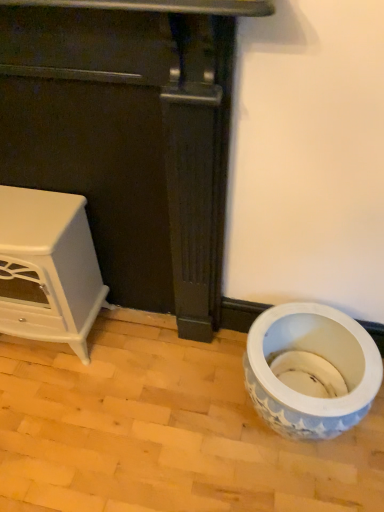
What do you see at coordinates (320, 356) in the screenshot? I see `blue and white ceramic vase at lower right` at bounding box center [320, 356].

Looking at this image, what is the approximate width of white glossy stove at left, which ranks as the 2th furniture in left-to-right order?

It is 7.08 inches.

This screenshot has height=512, width=384. Find the location of `blue and white ceramic vase at lower right`. blue and white ceramic vase at lower right is located at coordinates (320, 356).

Is white glossy stove at left, which ranks as the 2th furniture in left-to-right order, completely or partially outside of blue and white ceramic vase at lower right?

white glossy stove at left, which ranks as the 2th furniture in left-to-right order, is positioned outside blue and white ceramic vase at lower right.

Considering the points (103, 80) and (291, 307), which point is in front, point (103, 80) or point (291, 307)?

Positioned in front is point (103, 80).

Can you confirm if white glossy stove at left, which ranks as the 2th furniture in left-to-right order, is positioned to the right of blue and white ceramic vase at lower right?

No, white glossy stove at left, which ranks as the 2th furniture in left-to-right order, is not to the right of blue and white ceramic vase at lower right.

From the image's perspective, would you say white glossy stove at left, which ranks as the 2th furniture in left-to-right order, is shown under blue and white ceramic vase at lower right?

No, from the image's perspective, white glossy stove at left, which ranks as the 2th furniture in left-to-right order, is not below blue and white ceramic vase at lower right.

From a real-world perspective, which is physically above, blue and white ceramic vase at lower right or white glossy cabinet at left, which is the first furniture in left-to-right order?

white glossy cabinet at left, which is the first furniture in left-to-right order, is physically above.

Considering the sizes of blue and white ceramic vase at lower right and white glossy cabinet at left, which is the first furniture in left-to-right order, in the image, is blue and white ceramic vase at lower right taller or shorter than white glossy cabinet at left, which is the first furniture in left-to-right order,?

Considering their sizes, blue and white ceramic vase at lower right has less height than white glossy cabinet at left, which is the first furniture in left-to-right order.

How many degrees apart are the facing directions of blue and white ceramic vase at lower right and white glossy cabinet at left, the 2th furniture when ordered from right to left?

The angle between the facing direction of blue and white ceramic vase at lower right and the facing direction of white glossy cabinet at left, the 2th furniture when ordered from right to left, is 1.75 degrees.

Does blue and white ceramic vase at lower right have a greater width compared to white glossy cabinet at left, which is the first furniture in left-to-right order?

Correct, the width of blue and white ceramic vase at lower right exceeds that of white glossy cabinet at left, which is the first furniture in left-to-right order.

Considering the sizes of objects blue and white ceramic vase at lower right and white glossy stove at left, the first furniture viewed from the right, in the image provided, who is shorter, blue and white ceramic vase at lower right or white glossy stove at left, the first furniture viewed from the right,?

With less height is blue and white ceramic vase at lower right.

Is point (358, 380) positioned behind point (133, 221)?

No.

From the picture: From a real-world perspective, is blue and white ceramic vase at lower right located beneath white glossy stove at left, the first furniture viewed from the right?

Indeed, from a real-world perspective, blue and white ceramic vase at lower right is positioned beneath white glossy stove at left, the first furniture viewed from the right.

Can you confirm if blue and white ceramic vase at lower right is bigger than white glossy stove at left, which ranks as the 2th furniture in left-to-right order?

No, blue and white ceramic vase at lower right is not bigger than white glossy stove at left, which ranks as the 2th furniture in left-to-right order.

From a real-world perspective, is white glossy cabinet at left, which is the first furniture in left-to-right order, above or below white glossy stove at left, which ranks as the 2th furniture in left-to-right order?

From a real-world perspective, white glossy cabinet at left, which is the first furniture in left-to-right order, is physically below white glossy stove at left, which ranks as the 2th furniture in left-to-right order.

Which object is thinner, white glossy cabinet at left, which is the first furniture in left-to-right order, or white glossy stove at left, the first furniture viewed from the right?

white glossy stove at left, the first furniture viewed from the right.

Is white glossy cabinet at left, which is the first furniture in left-to-right order, in front of white glossy stove at left, the first furniture viewed from the right?

No, white glossy cabinet at left, which is the first furniture in left-to-right order, is behind white glossy stove at left, the first furniture viewed from the right.

In terms of height, does white glossy cabinet at left, which is the first furniture in left-to-right order, look taller or shorter compared to blue and white ceramic vase at lower right?

white glossy cabinet at left, which is the first furniture in left-to-right order, is taller than blue and white ceramic vase at lower right.

Is white glossy cabinet at left, the 2th furniture when ordered from right to left, facing away from blue and white ceramic vase at lower right?

No.

Does white glossy cabinet at left, which is the first furniture in left-to-right order, have a smaller size compared to blue and white ceramic vase at lower right?

No.

Locate an element on the screen. furniture behind the white glossy stove at left, the first furniture viewed from the right is located at coordinates (48, 268).

In the image, is white glossy stove at left, the first furniture viewed from the right, on the left side or the right side of white glossy cabinet at left, which is the first furniture in left-to-right order?

white glossy stove at left, the first furniture viewed from the right, is to the right of white glossy cabinet at left, which is the first furniture in left-to-right order.

In the scene shown: Is white glossy stove at left, which ranks as the 2th furniture in left-to-right order, in front of or behind white glossy cabinet at left, which is the first furniture in left-to-right order, in the image?

white glossy stove at left, which ranks as the 2th furniture in left-to-right order, is in front of white glossy cabinet at left, which is the first furniture in left-to-right order.

How many degrees apart are the facing directions of white glossy stove at left, the first furniture viewed from the right, and white glossy cabinet at left, the 2th furniture when ordered from right to left?

The angular difference between white glossy stove at left, the first furniture viewed from the right, and white glossy cabinet at left, the 2th furniture when ordered from right to left, is 0.402 degrees.

Locate an element on the screen. The height and width of the screenshot is (512, 384). toilet that appears on the right of white glossy stove at left, the first furniture viewed from the right is located at coordinates (320, 356).

This screenshot has height=512, width=384. What are the coordinates of `toilet in front of the white glossy cabinet at left, which is the first furniture in left-to-right order` in the screenshot? It's located at (320, 356).

Estimate the real-world distances between objects in this image. Which object is closer to blue and white ceramic vase at lower right, white glossy cabinet at left, the 2th furniture when ordered from right to left, or white glossy stove at left, the first furniture viewed from the right?

white glossy stove at left, the first furniture viewed from the right.

When comparing their distances from white glossy cabinet at left, the 2th furniture when ordered from right to left, does blue and white ceramic vase at lower right or white glossy stove at left, which ranks as the 2th furniture in left-to-right order, seem further?

blue and white ceramic vase at lower right is positioned further to the anchor white glossy cabinet at left, the 2th furniture when ordered from right to left.

Based on the photo, considering their positions, is blue and white ceramic vase at lower right positioned further to white glossy stove at left, the first furniture viewed from the right, than white glossy cabinet at left, the 2th furniture when ordered from right to left?

Among the two, blue and white ceramic vase at lower right is located further to white glossy stove at left, the first furniture viewed from the right.

Based on their spatial positions, is white glossy stove at left, the first furniture viewed from the right, or blue and white ceramic vase at lower right further from white glossy cabinet at left, the 2th furniture when ordered from right to left?

blue and white ceramic vase at lower right is further to white glossy cabinet at left, the 2th furniture when ordered from right to left.

Considering their positions, is white glossy cabinet at left, the 2th furniture when ordered from right to left, positioned further to white glossy stove at left, which ranks as the 2th furniture in left-to-right order, than blue and white ceramic vase at lower right?

blue and white ceramic vase at lower right lies further to white glossy stove at left, which ranks as the 2th furniture in left-to-right order, than the other object.

When comparing their distances from blue and white ceramic vase at lower right, does white glossy stove at left, which ranks as the 2th furniture in left-to-right order, or white glossy cabinet at left, the 2th furniture when ordered from right to left, seem further?

Based on the image, white glossy cabinet at left, the 2th furniture when ordered from right to left, appears to be further to blue and white ceramic vase at lower right.

This screenshot has height=512, width=384. What are the coordinates of `furniture between white glossy cabinet at left, the 2th furniture when ordered from right to left, and blue and white ceramic vase at lower right` in the screenshot? It's located at (129, 135).